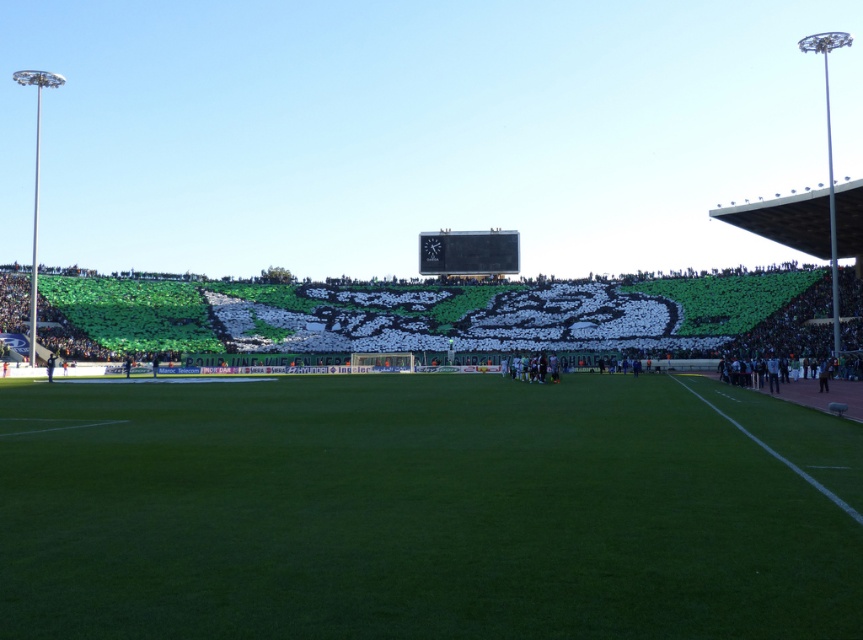
You are a drone operator tasked with capturing aerial footage of the football stadium. Your drone is currently positioned 20 feet above the green artificial turf at center. To ensure safety, you need to maintain a minimum altitude of 20 feet above the ground at all times. Is your current altitude sufficient?

The green artificial turf at center is 18.82 feet away from the viewer. Since the drone is positioned 20 feet above the green artificial turf at center, the altitude is sufficient as it exceeds the minimum required 20 feet.

You are a photographer positioned at the edge of the field. You want to capture a photo of the black glossy scoreboard at center while ensuring the green artificial turf at center is visible in the background. Based on their positions, is the scoreboard to the right or left side of the frame?

The black glossy scoreboard at center is to the right of the green artificial turf at center. Since the photographer is at the edge of the field, the scoreboard would appear on the right side of the frame while the green artificial turf at center is positioned to its left in the background.

You are a drone operator preparing to fly a drone over the football stadium. You need to ensure that the drone can safely pass between the green artificial turf at center and the black glossy scoreboard at center without hitting either. Given that the drone is 1 meter in height, can it fly between them?

The green artificial turf at center is not as tall as black glossy scoreboard at center. Since the scoreboard is taller, the vertical space between them allows the drone to pass safely at 1 meter in height.